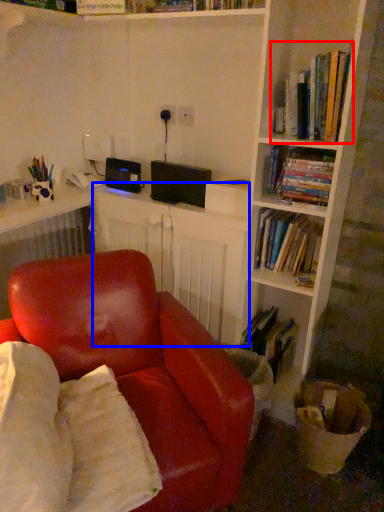
Question: Which of the following is the closest to the observer, book (highlighted by a red box) or computer desk (highlighted by a blue box)?

Choices:
 (A) book
 (B) computer desk

Answer: (A)